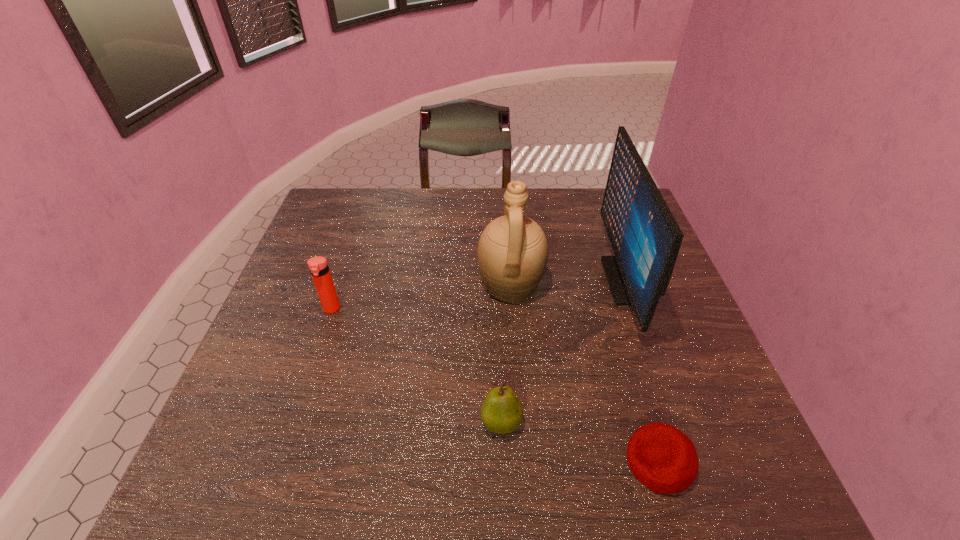
What are the coordinates of `free point between the pitcher and the computer monitor` in the screenshot? It's located at (567, 282).

Find the location of a particular element. The width and height of the screenshot is (960, 540). free area in between the leftmost object and the pitcher is located at coordinates (421, 297).

Locate an element on the screen. empty space between the beanbag and the third tallest object is located at coordinates (495, 386).

You are a GUI agent. You are given a task and a screenshot of the screen. Output one action in this format:
    pyautogui.click(x=<x>, y=<y>)
    Task: Click on the vacant space in between the beanbag and the computer monitor
    This screenshot has height=540, width=960.
    Given the screenshot: What is the action you would take?
    pyautogui.click(x=642, y=371)

At what (x,y) coordinates should I click in order to perform the action: click on empty space between the pitcher and the pear. Please return your answer as a coordinate pair (x, y). Looking at the image, I should click on (506, 354).

Find the location of a particular element. free space between the pitcher and the leftmost object is located at coordinates (421, 297).

Identify the location of free space between the fourth tallest object and the shortest object. The height and width of the screenshot is (540, 960). (580, 442).

This screenshot has width=960, height=540. Find the location of `empty space between the second shortest object and the beanbag`. empty space between the second shortest object and the beanbag is located at coordinates (580, 442).

This screenshot has width=960, height=540. In order to click on free space between the pitcher and the second shortest object in this screenshot , I will do `click(506, 354)`.

Image resolution: width=960 pixels, height=540 pixels. What are the coordinates of `the second closest object relative to the computer monitor` in the screenshot? It's located at (664, 459).